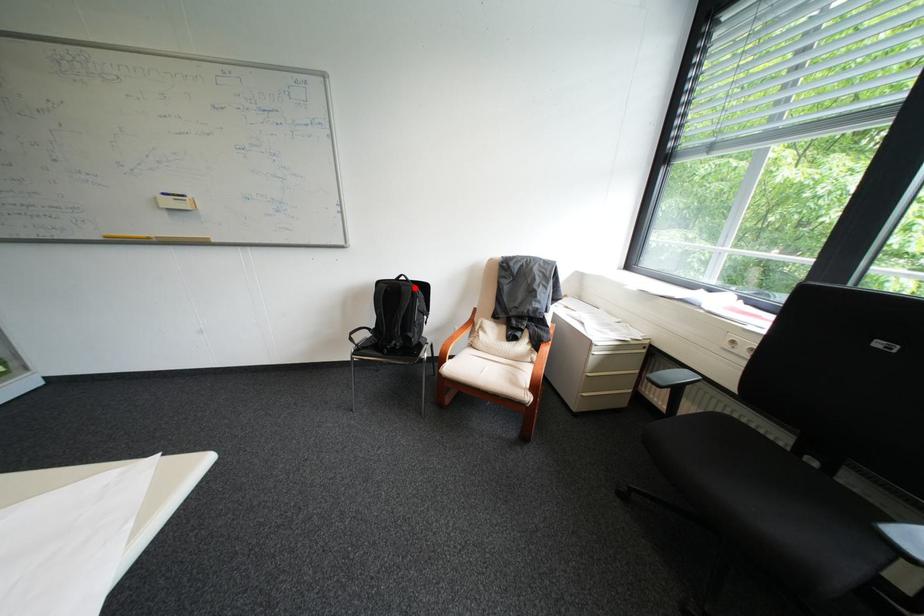
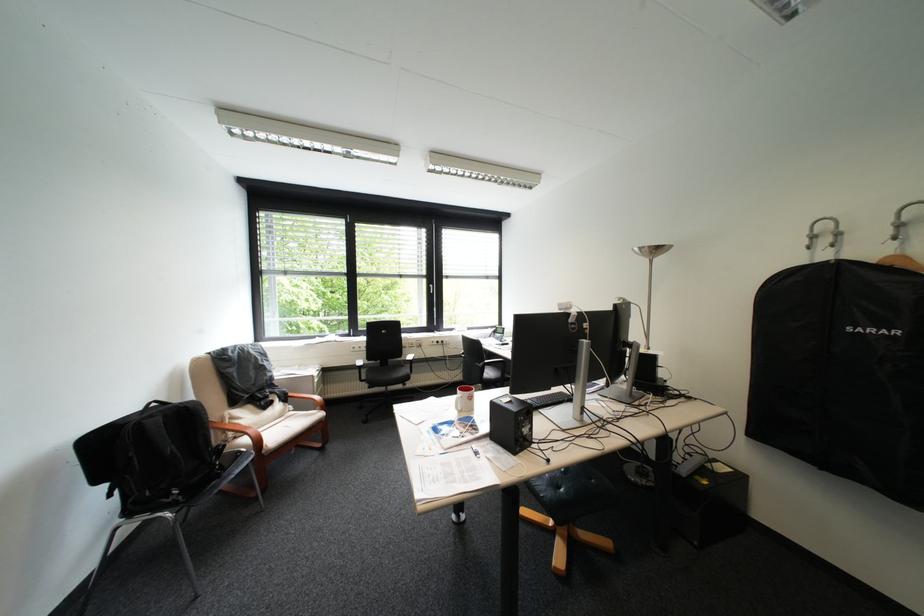
In the second image, find the point that corresponds to the highlighted location in the first image.

(199, 407)